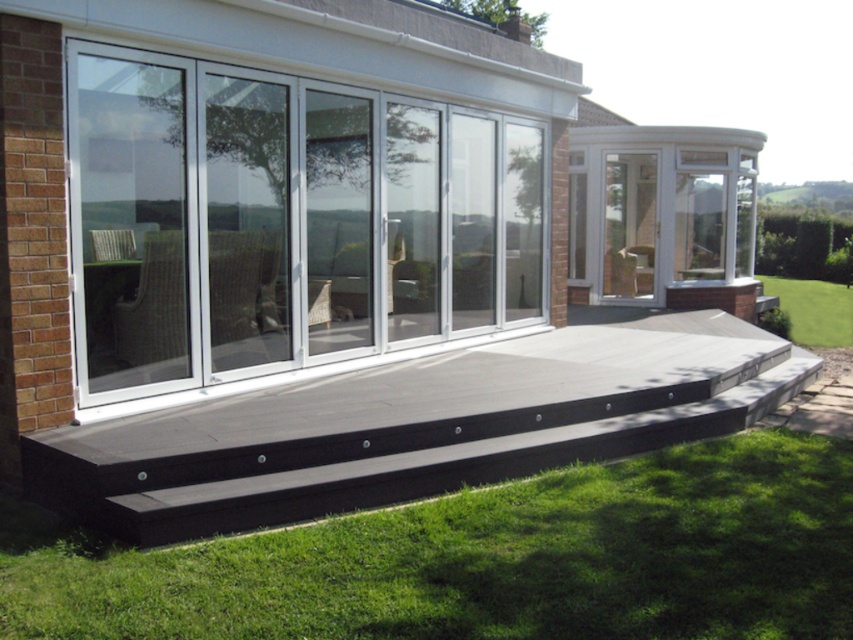
Is black wood deck at center wider than green grass at lower right?

No.

Does black wood deck at center have a lesser width compared to green grass at lower right?

Indeed, black wood deck at center has a lesser width compared to green grass at lower right.

Image resolution: width=853 pixels, height=640 pixels. Describe the element at coordinates (416, 426) in the screenshot. I see `black wood deck at center` at that location.

I want to click on black wood deck at center, so click(x=416, y=426).

Does black wood deck at center have a lesser width compared to clear glass door at center?

Yes.

You are a GUI agent. You are given a task and a screenshot of the screen. Output one action in this format:
    pyautogui.click(x=<x>, y=<y>)
    Task: Click on the black wood deck at center
    The width and height of the screenshot is (853, 640).
    Given the screenshot: What is the action you would take?
    pyautogui.click(x=416, y=426)

Identify the location of black wood deck at center. (416, 426).

In the scene shown: Is white aluminum sliding door at center below black wood deck at center?

No.

Who is higher up, white aluminum sliding door at center or black wood deck at center?

white aluminum sliding door at center is above.

Find the location of a particular element. The height and width of the screenshot is (640, 853). white aluminum sliding door at center is located at coordinates (283, 221).

The width and height of the screenshot is (853, 640). In order to click on white aluminum sliding door at center in this screenshot , I will do `click(283, 221)`.